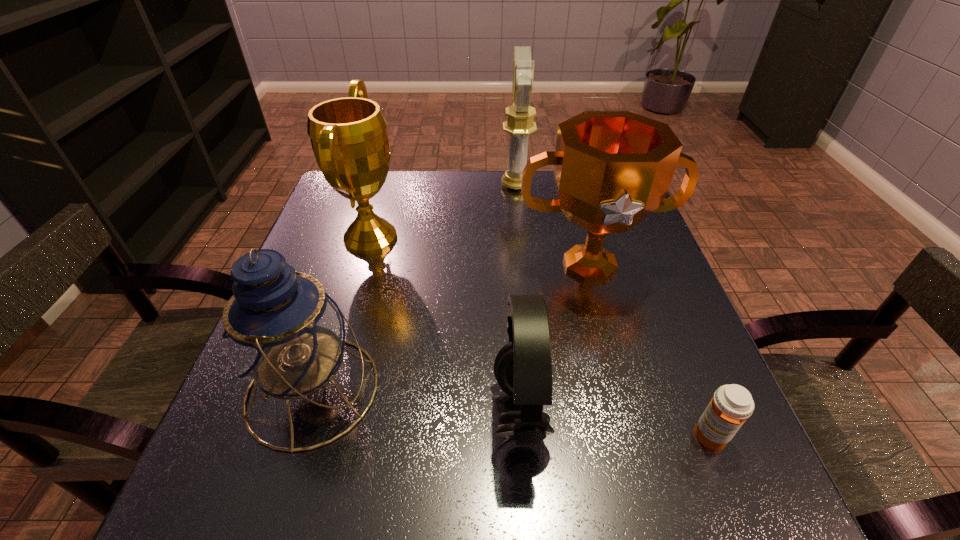
Image resolution: width=960 pixels, height=540 pixels. I want to click on the farthest award, so click(x=520, y=123).

Locate an element on the screen. the leftmost award is located at coordinates (349, 138).

I want to click on lantern, so click(x=284, y=334).

The height and width of the screenshot is (540, 960). Identify the location of earphone. (523, 368).

Image resolution: width=960 pixels, height=540 pixels. I want to click on the shortest object, so [731, 405].

What are the coordinates of `vacant space located 0.320m on the front-facing side of the farthest object` in the screenshot? It's located at (388, 185).

Image resolution: width=960 pixels, height=540 pixels. In order to click on free space located on the front-facing side of the farthest object in this screenshot , I will do (x=367, y=185).

Locate an element on the screen. vacant space situated on the front-facing side of the farthest object is located at coordinates (417, 185).

Where is `free region located on the front-facing side of the leftmost award`? This screenshot has width=960, height=540. free region located on the front-facing side of the leftmost award is located at coordinates (551, 238).

Where is `blank area located on the front-facing side of the lantern`? This screenshot has width=960, height=540. blank area located on the front-facing side of the lantern is located at coordinates (598, 390).